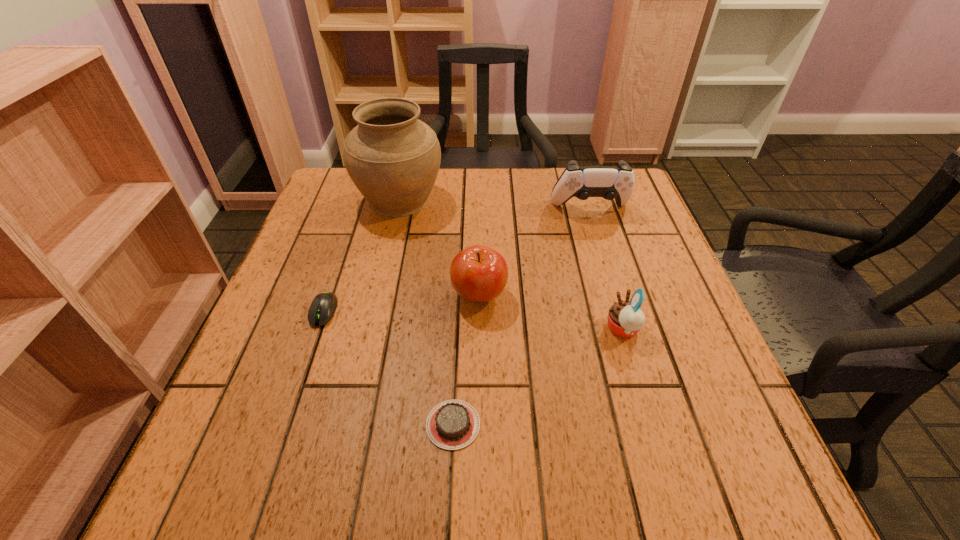
Identify the location of the third closest object to the urn. This screenshot has width=960, height=540. (609, 182).

I want to click on the second closest object to the control, so click(x=393, y=158).

This screenshot has height=540, width=960. Find the location of `vacant space that satisfies the following two spatial constraints: 1. on the front side of the shortest object; 2. on the right side of the urn`. vacant space that satisfies the following two spatial constraints: 1. on the front side of the shortest object; 2. on the right side of the urn is located at coordinates (348, 424).

Image resolution: width=960 pixels, height=540 pixels. In order to click on free space that satisfies the following two spatial constraints: 1. on the front-facing side of the control; 2. on the front-facing side of the third shortest object in this screenshot , I will do `click(627, 329)`.